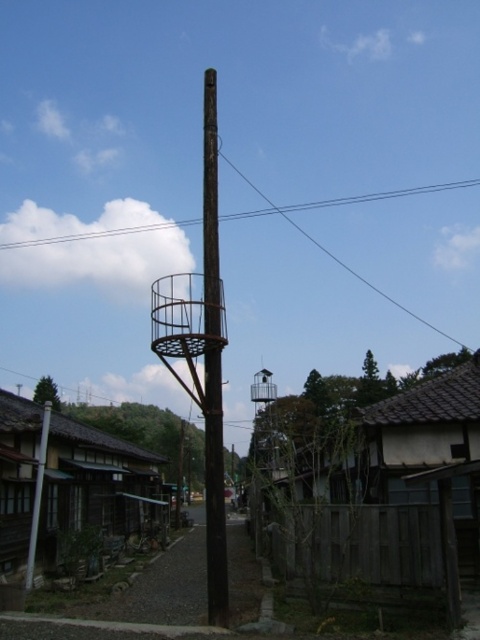
Question: Considering the real-world distances, which object is closest to the rusty metal pole at left?

Choices:
 (A) rustic wood tower at center
 (B) wooden shingles hut at lower left
 (C) brown wooden pole at upper center

Answer: (B)

Question: Is wooden shingles hut at lower left closer to camera compared to rustic metal water tower at center?

Choices:
 (A) no
 (B) yes

Answer: (B)

Question: Can you confirm if wooden shingles hut at lower left is positioned below black wire at upper center?

Choices:
 (A) no
 (B) yes

Answer: (B)

Question: Which object appears closest to the camera in this image?

Choices:
 (A) rustic metal water tower at center
 (B) brown wooden pole at upper center
 (C) rusty metal pole at left

Answer: (C)

Question: Does rustic wood tower at center have a greater width compared to brown wooden pole at upper center?

Choices:
 (A) no
 (B) yes

Answer: (A)

Question: Which point appears closest to the camera in this image?

Choices:
 (A) (386, 461)
 (B) (15, 470)

Answer: (A)